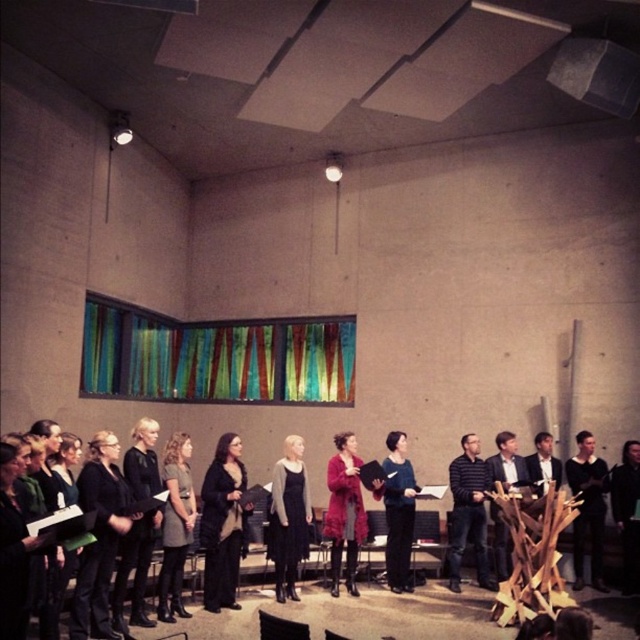
Question: Based on their relative distances, which object is farther from the matte pink coat at center?

Choices:
 (A) black wool sweater at center
 (B) black dress at center

Answer: (A)

Question: Which object is farther from the camera taking this photo?

Choices:
 (A) dark gray dress at center
 (B) matte pink coat at center
 (C) black dress at center

Answer: (B)

Question: Can you confirm if striped sweater at center is positioned to the left of matte black dress at center?

Choices:
 (A) no
 (B) yes

Answer: (A)

Question: Is black matte dress at center to the left of striped sweater at center from the viewer's perspective?

Choices:
 (A) yes
 (B) no

Answer: (A)

Question: Does matte black dress at center appear over black fabric coat at center?

Choices:
 (A) no
 (B) yes

Answer: (B)

Question: Among these points, which one is nearest to the camera?

Choices:
 (A) (141, 532)
 (B) (614, 625)

Answer: (A)